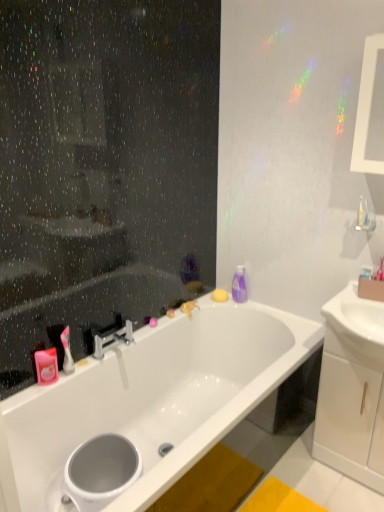
Question: Is white glossy bathtub at center at the left side of white glossy toilet bowl at lower left?

Choices:
 (A) no
 (B) yes

Answer: (A)

Question: Is white glossy bathtub at center oriented towards white glossy toilet bowl at lower left?

Choices:
 (A) no
 (B) yes

Answer: (B)

Question: Would you say white glossy bathtub at center is a long distance from white glossy toilet bowl at lower left?

Choices:
 (A) no
 (B) yes

Answer: (A)

Question: Are white glossy bathtub at center and white glossy toilet bowl at lower left beside each other?

Choices:
 (A) no
 (B) yes

Answer: (A)

Question: Is white glossy bathtub at center positioned with its back to white glossy toilet bowl at lower left?

Choices:
 (A) no
 (B) yes

Answer: (B)

Question: Considering the positions of white glossy cabinet at right and silver metallic faucet at center in the image, is white glossy cabinet at right bigger or smaller than silver metallic faucet at center?

Choices:
 (A) big
 (B) small

Answer: (A)

Question: From their relative heights in the image, would you say white glossy cabinet at right is taller or shorter than silver metallic faucet at center?

Choices:
 (A) short
 (B) tall

Answer: (B)

Question: Does point (352, 421) appear closer or farther from the camera than point (130, 343)?

Choices:
 (A) farther
 (B) closer

Answer: (B)

Question: Considering their positions, is white glossy cabinet at right located in front of or behind silver metallic faucet at center?

Choices:
 (A) front
 (B) behind

Answer: (A)

Question: Is silver metallic faucet at center spatially inside white glossy cabinet at right, or outside of it?

Choices:
 (A) outside
 (B) inside

Answer: (A)

Question: In terms of height, does silver metallic faucet at center look taller or shorter compared to white glossy cabinet at right?

Choices:
 (A) short
 (B) tall

Answer: (A)

Question: From a real-world perspective, is silver metallic faucet at center above or below white glossy cabinet at right?

Choices:
 (A) below
 (B) above

Answer: (B)

Question: Relative to white glossy cabinet at right, is silver metallic faucet at center in front or behind?

Choices:
 (A) behind
 (B) front

Answer: (A)

Question: From a real-world perspective, is pink matte soap at upper left, which is the 1th toiletry in front-to-back order, positioned above or below white glossy sink at right?

Choices:
 (A) below
 (B) above

Answer: (A)

Question: From the image's perspective, is pink matte soap at upper left, positioned as the first toiletry in left-to-right order, positioned above or below white glossy sink at right?

Choices:
 (A) below
 (B) above

Answer: (A)